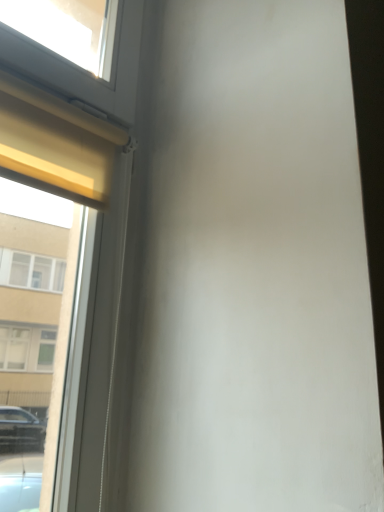
Question: Should I look upward or downward to see white matte window at upper left?

Choices:
 (A) up
 (B) down

Answer: (A)